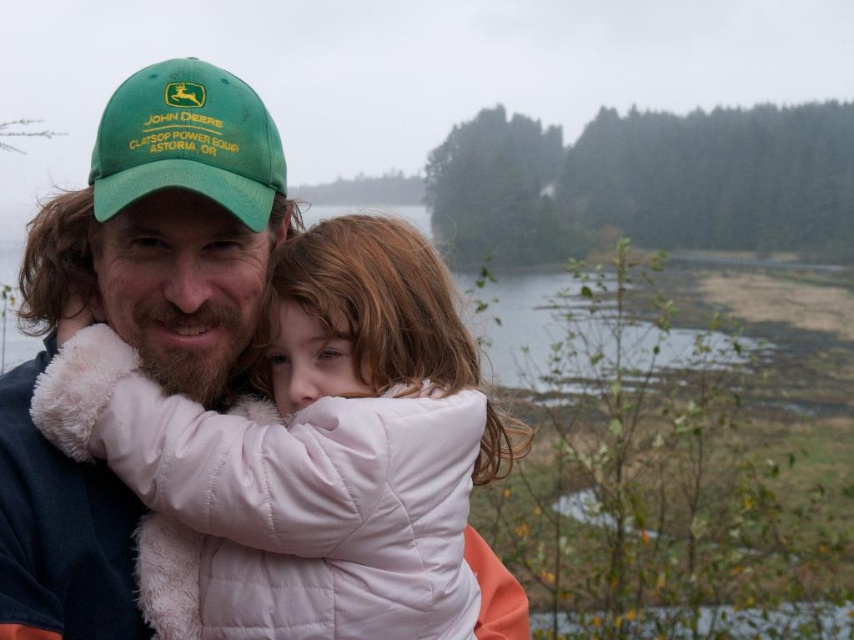
Question: Which point is farther from the camera taking this photo?

Choices:
 (A) (416, 451)
 (B) (107, 128)

Answer: (B)

Question: Which of the following is the closest to the observer?

Choices:
 (A) green fabric baseball cap at upper left
 (B) white puffy jacket at center

Answer: (B)

Question: Does white puffy jacket at center have a lesser width compared to green fabric baseball cap at upper left?

Choices:
 (A) no
 (B) yes

Answer: (A)

Question: Can you confirm if white puffy jacket at center is positioned to the right of green fabric baseball cap at upper left?

Choices:
 (A) no
 (B) yes

Answer: (B)

Question: Is white puffy jacket at center to the left of green fabric baseball cap at upper left from the viewer's perspective?

Choices:
 (A) yes
 (B) no

Answer: (B)

Question: Which point is closer to the camera?

Choices:
 (A) white puffy jacket at center
 (B) green fabric baseball cap at upper left

Answer: (A)